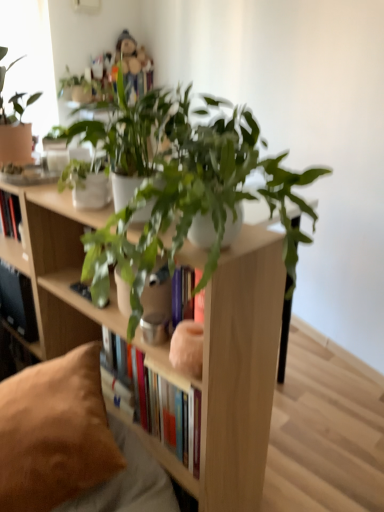
In order to face green matte plant at upper center, marked as the second houseplant in a back-to-front arrangement, should I rotate leftwards or rightwards?

You should rotate left by 10.623 degrees.

From the picture: What is the approximate height of green matte plant at center, the second houseplant from the front?

green matte plant at center, the second houseplant from the front, is 55.18 centimeters tall.

Measure the distance between black matte shelf at lower left and camera.

5.36 feet.

What do you see at coordinates (17, 302) in the screenshot?
I see `black matte shelf at lower left` at bounding box center [17, 302].

Where is `matte white bookcase at center`? matte white bookcase at center is located at coordinates (236, 375).

Locate an element on the screen. This screenshot has height=512, width=384. matte glass window screen at upper left is located at coordinates (30, 60).

Is green matte plant at center, the second houseplant from the front, at the back of black matte shelf at lower left?

black matte shelf at lower left does not have its back to green matte plant at center, the second houseplant from the front.

Between black matte shelf at lower left and green matte plant at center, the second houseplant from the front, which one has less height?

black matte shelf at lower left.

Could green matte plant at center, which is counted as the 1th houseplant, starting from the back, be considered to be inside black matte shelf at lower left?

No, green matte plant at center, which is counted as the 1th houseplant, starting from the back, is not surrounded by black matte shelf at lower left.

Which of these two, black matte shelf at lower left or green matte plant at center, which is counted as the 1th houseplant, starting from the back, is bigger?

With larger size is green matte plant at center, which is counted as the 1th houseplant, starting from the back.

Is green matte plant at center, the second houseplant from the front, wider than matte white bookcase at center?

Incorrect, the width of green matte plant at center, the second houseplant from the front, does not surpass that of matte white bookcase at center.

Are green matte plant at center, which is counted as the 1th houseplant, starting from the back, and matte white bookcase at center beside each other?

No, green matte plant at center, which is counted as the 1th houseplant, starting from the back, is not next to matte white bookcase at center.

Considering the positions of objects green matte plant at center, the second houseplant from the front, and matte white bookcase at center in the image provided, who is more to the left, green matte plant at center, the second houseplant from the front, or matte white bookcase at center?

Positioned to the left is matte white bookcase at center.

Would you say green matte plant at center, which is counted as the 1th houseplant, starting from the back, is inside or outside matte white bookcase at center?

green matte plant at center, which is counted as the 1th houseplant, starting from the back, is not inside matte white bookcase at center, it's outside.

Is black matte shelf at lower left smaller than brown suede pillow at lower left?

Indeed, black matte shelf at lower left has a smaller size compared to brown suede pillow at lower left.

Is point (22, 282) behind point (71, 466)?

Yes, it is behind point (71, 466).

From the image's perspective, relative to brown suede pillow at lower left, is black matte shelf at lower left above or below?

From the image's perspective, black matte shelf at lower left appears above brown suede pillow at lower left.

Is black matte shelf at lower left taller than brown suede pillow at lower left?

Indeed, black matte shelf at lower left has a greater height compared to brown suede pillow at lower left.

From a real-world perspective, is matte white bookcase at center located higher than brown suede pillow at lower left?

→ Yes.

Locate an element on the screen. Image resolution: width=384 pixels, height=512 pixels. pillow that is below the matte white bookcase at center (from the image's perspective) is located at coordinates (55, 433).

Can you confirm if matte white bookcase at center is smaller than brown suede pillow at lower left?

Incorrect, matte white bookcase at center is not smaller in size than brown suede pillow at lower left.

Considering the points (186, 241) and (9, 433), which point is behind, point (186, 241) or point (9, 433)?

The point (9, 433) is behind.

Looking at this image, which of these two, brown suede pillow at lower left or black matte shelf at lower left, is wider?

Wider between the two is brown suede pillow at lower left.

Which is farther, (x=39, y=448) or (x=30, y=326)?

The point (x=30, y=326) is farther.

Could you tell me if brown suede pillow at lower left is turned towards black matte shelf at lower left?

No, brown suede pillow at lower left is not aimed at black matte shelf at lower left.

From a real-world perspective, between brown suede pillow at lower left and black matte shelf at lower left, who is vertically higher?

black matte shelf at lower left.

Which is nearer, (x=136, y=134) or (x=207, y=331)?

The point (x=207, y=331) is in front.

From a real-world perspective, is green matte plant at upper center, marked as the second houseplant in a back-to-front arrangement, positioned above or below matte white bookcase at center?

From a real-world perspective, green matte plant at upper center, marked as the second houseplant in a back-to-front arrangement, is physically above matte white bookcase at center.

Considering the sizes of objects green matte plant at upper center, the 1th houseplant when ordered from front to back, and matte white bookcase at center in the image provided, who is bigger, green matte plant at upper center, the 1th houseplant when ordered from front to back, or matte white bookcase at center?

matte white bookcase at center is bigger.

From the image's perspective, who appears lower, matte white bookcase at center or green matte plant at upper center, marked as the second houseplant in a back-to-front arrangement?

matte white bookcase at center appears lower in the image.

Considering the sizes of objects matte white bookcase at center and green matte plant at upper center, marked as the second houseplant in a back-to-front arrangement, in the image provided, who is smaller, matte white bookcase at center or green matte plant at upper center, marked as the second houseplant in a back-to-front arrangement,?

green matte plant at upper center, marked as the second houseplant in a back-to-front arrangement, is smaller.

Which is more to the right, matte white bookcase at center or green matte plant at upper center, the 1th houseplant when ordered from front to back?

Positioned to the right is green matte plant at upper center, the 1th houseplant when ordered from front to back.

Can you confirm if matte white bookcase at center is wider than green matte plant at upper center, marked as the second houseplant in a back-to-front arrangement?

Indeed, matte white bookcase at center has a greater width compared to green matte plant at upper center, marked as the second houseplant in a back-to-front arrangement.

Locate an element on the screen. This screenshot has width=384, height=512. shelf on the left of green matte plant at center, which is counted as the 1th houseplant, starting from the back is located at coordinates (17, 302).

Locate an element on the screen. bookcase below the green matte plant at center, the second houseplant from the front (from a real-world perspective) is located at coordinates (236, 375).

Based on their spatial positions, is matte glass window screen at upper left or brown suede pillow at lower left further from green matte plant at center, the second houseplant from the front?

matte glass window screen at upper left is positioned further to the anchor green matte plant at center, the second houseplant from the front.

When comparing their distances from matte glass window screen at upper left, does black matte shelf at lower left or matte white bookcase at center seem further?

matte white bookcase at center.

Estimate the real-world distances between objects in this image. Which object is closer to green matte plant at upper center, the 1th houseplant when ordered from front to back, brown suede pillow at lower left or matte glass window screen at upper left?

brown suede pillow at lower left.

Looking at the image, which one is located closer to green matte plant at upper center, marked as the second houseplant in a back-to-front arrangement, green matte plant at center, the second houseplant from the front, or brown suede pillow at lower left?

Based on the image, green matte plant at center, the second houseplant from the front, appears to be nearer to green matte plant at upper center, marked as the second houseplant in a back-to-front arrangement.

In the scene shown: When comparing their distances from green matte plant at center, which is counted as the 1th houseplant, starting from the back, does black matte shelf at lower left or green matte plant at upper center, the 1th houseplant when ordered from front to back, seem closer?

green matte plant at upper center, the 1th houseplant when ordered from front to back, is closer to green matte plant at center, which is counted as the 1th houseplant, starting from the back.

Which object lies further to the anchor point matte white bookcase at center, green matte plant at upper center, marked as the second houseplant in a back-to-front arrangement, or brown suede pillow at lower left?

Among the two, green matte plant at upper center, marked as the second houseplant in a back-to-front arrangement, is located further to matte white bookcase at center.

Considering their positions, is matte glass window screen at upper left positioned further to green matte plant at upper center, the 1th houseplant when ordered from front to back, than green matte plant at center, which is counted as the 1th houseplant, starting from the back?

matte glass window screen at upper left lies further to green matte plant at upper center, the 1th houseplant when ordered from front to back, than the other object.

Estimate the real-world distances between objects in this image. Which object is further from green matte plant at center, which is counted as the 1th houseplant, starting from the back, matte white bookcase at center or matte glass window screen at upper left?

matte glass window screen at upper left is further to green matte plant at center, which is counted as the 1th houseplant, starting from the back.

Find the location of a particular element. shelf that lies between green matte plant at center, which is counted as the 1th houseplant, starting from the back, and brown suede pillow at lower left from top to bottom is located at coordinates (17, 302).

You are a GUI agent. You are given a task and a screenshot of the screen. Output one action in this format:
    pyautogui.click(x=<x>, y=<y>)
    Task: Click on the bookcase between green matte plant at upper center, the 1th houseplant when ordered from front to back, and black matte shelf at lower left from front to back
    Image resolution: width=384 pixels, height=512 pixels.
    Given the screenshot: What is the action you would take?
    pyautogui.click(x=236, y=375)

You are a GUI agent. You are given a task and a screenshot of the screen. Output one action in this format:
    pyautogui.click(x=<x>, y=<y>)
    Task: Click on the pillow located between matte white bookcase at center and black matte shelf at lower left in the depth direction
    The image size is (384, 512).
    Given the screenshot: What is the action you would take?
    pyautogui.click(x=55, y=433)

At what (x,y) coordinates should I click in order to perform the action: click on houseplant between green matte plant at center, the second houseplant from the front, and matte white bookcase at center in the up-down direction. Please return your answer as a coordinate pair (x, y). The width and height of the screenshot is (384, 512). Looking at the image, I should click on (126, 130).